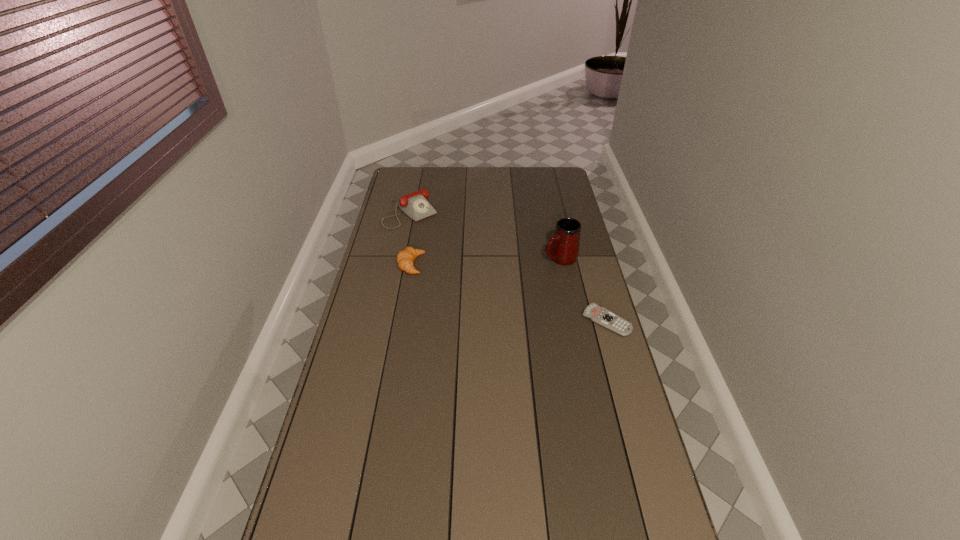
Identify the location of free space located 0.180m on the side of the mug with the handle. The height and width of the screenshot is (540, 960). (509, 276).

In order to click on vacant region located on the dial of the third shortest object in this screenshot , I will do `click(464, 262)`.

You are a GUI agent. You are given a task and a screenshot of the screen. Output one action in this format:
    pyautogui.click(x=<x>, y=<y>)
    Task: Click on the free space located on the dial of the third shortest object
    
    Given the screenshot: What is the action you would take?
    pyautogui.click(x=436, y=237)

In order to click on vacant region located 0.240m on the dial of the third shortest object in this screenshot , I will do pos(454,253).

This screenshot has width=960, height=540. I want to click on crescent roll present at the left edge, so click(405, 258).

You are a GUI agent. You are given a task and a screenshot of the screen. Output one action in this format:
    pyautogui.click(x=<x>, y=<y>)
    Task: Click on the telephone present at the left edge
    
    Given the screenshot: What is the action you would take?
    pyautogui.click(x=415, y=205)

You are a GUI agent. You are given a task and a screenshot of the screen. Output one action in this format:
    pyautogui.click(x=<x>, y=<y>)
    Task: Click on the remote control at the right edge
    
    Given the screenshot: What is the action you would take?
    pyautogui.click(x=599, y=315)

At what (x,y) coordinates should I click in order to perform the action: click on mug at the right edge. Please return your answer as a coordinate pair (x, y). Looking at the image, I should click on (563, 248).

The image size is (960, 540). In order to click on vacant area at the far edge in this screenshot , I will do `click(501, 169)`.

Image resolution: width=960 pixels, height=540 pixels. In the image, there is a desktop. In order to click on vacant area at the near edge in this screenshot , I will do `click(593, 508)`.